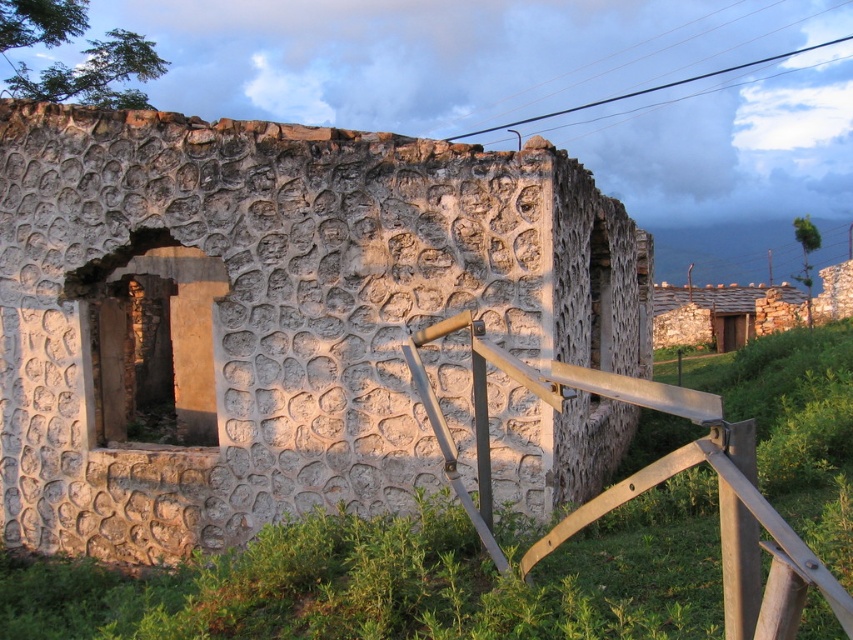
Question: Is rough stone wall at center below metallic silver rail at lower right?

Choices:
 (A) no
 (B) yes

Answer: (A)

Question: Is metallic silver rail at lower right closer to the viewer compared to stone roof hut at upper right?

Choices:
 (A) no
 (B) yes

Answer: (B)

Question: Observing the image, what is the correct spatial positioning of metallic silver rail at lower right in reference to stone roof hut at upper right?

Choices:
 (A) above
 (B) below

Answer: (B)

Question: Estimate the real-world distances between objects in this image. Which object is farther from the rough stone wall at center?

Choices:
 (A) metallic silver rail at lower right
 (B) stone roof hut at upper right

Answer: (B)

Question: Which object appears closest to the camera in this image?

Choices:
 (A) stone roof hut at upper right
 (B) metallic silver rail at lower right
 (C) rough stone wall at center

Answer: (B)

Question: Estimate the real-world distances between objects in this image. Which object is closer to the rough stone wall at center?

Choices:
 (A) stone roof hut at upper right
 (B) metallic silver rail at lower right

Answer: (B)